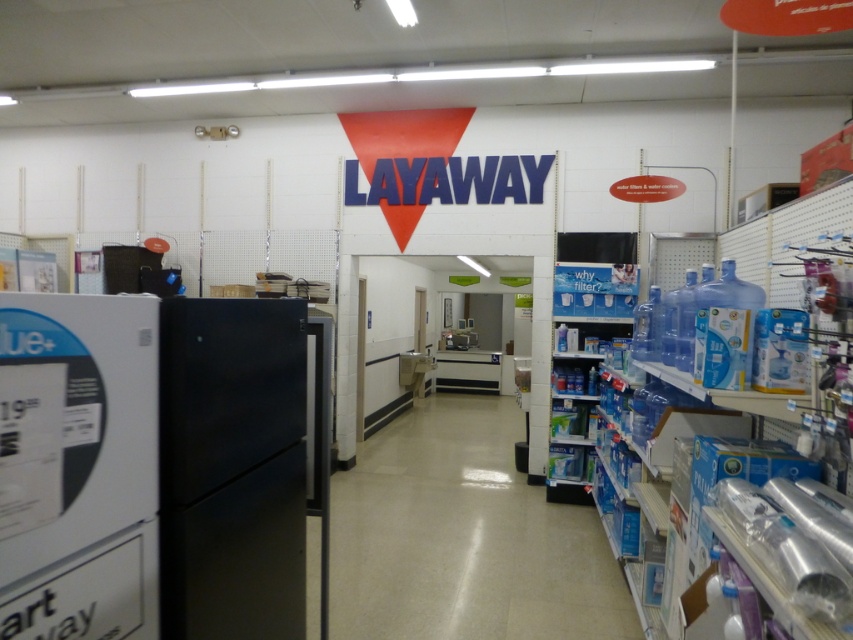
Question: Does clear plastic bottles at center have a lesser width compared to clear plastic bottle at right?

Choices:
 (A) no
 (B) yes

Answer: (A)

Question: In this image, where is clear plastic bottles at center located relative to clear plastic bottle at right?

Choices:
 (A) right
 (B) left

Answer: (B)

Question: Which point is closer to the camera?

Choices:
 (A) clear plastic bottles at center
 (B) clear plastic bottle at right

Answer: (B)

Question: Which of the following is the closest to the observer?

Choices:
 (A) clear plastic bottle at right
 (B) clear plastic bottles at center

Answer: (A)

Question: Is clear plastic bottles at center to the left of clear plastic bottle at right from the viewer's perspective?

Choices:
 (A) no
 (B) yes

Answer: (B)